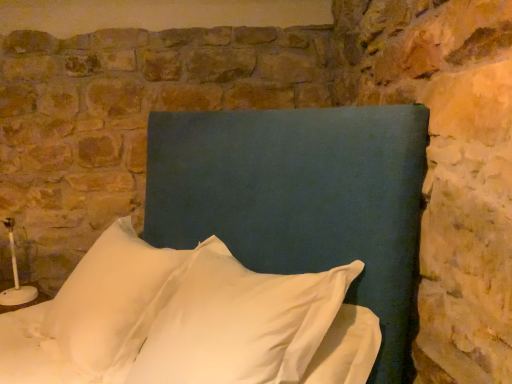
Question: Would you consider matte blue headboard at center to be distant from white fabric pillow at center, which is the first pillow in right-to-left order?

Choices:
 (A) yes
 (B) no

Answer: (B)

Question: From the image's perspective, is matte blue headboard at center under white fabric pillow at center, the second pillow in the left-to-right sequence?

Choices:
 (A) no
 (B) yes

Answer: (A)

Question: Is matte blue headboard at center shorter than white fabric pillow at center, the second pillow in the left-to-right sequence?

Choices:
 (A) no
 (B) yes

Answer: (A)

Question: Is matte blue headboard at center completely or partially outside of white fabric pillow at center, the second pillow in the left-to-right sequence?

Choices:
 (A) no
 (B) yes

Answer: (A)

Question: Is white fabric pillow at center, the second pillow in the left-to-right sequence, at the back of matte blue headboard at center?

Choices:
 (A) yes
 (B) no

Answer: (A)

Question: Is matte blue headboard at center oriented towards white fabric pillow at center, which is the first pillow in right-to-left order?

Choices:
 (A) yes
 (B) no

Answer: (A)

Question: Does matte blue headboard at center have a lesser height compared to white soft pillow at center, acting as the 1th pillow starting from the left?

Choices:
 (A) no
 (B) yes

Answer: (A)

Question: Can you confirm if matte blue headboard at center is positioned to the left of white soft pillow at center, acting as the 1th pillow starting from the left?

Choices:
 (A) no
 (B) yes

Answer: (A)

Question: Is the position of matte blue headboard at center more distant than that of white soft pillow at center, acting as the 1th pillow starting from the left?

Choices:
 (A) yes
 (B) no

Answer: (B)

Question: From a real-world perspective, is matte blue headboard at center physically below white soft pillow at center, positioned as the 2th pillow in right-to-left order?

Choices:
 (A) no
 (B) yes

Answer: (A)

Question: From the image's perspective, is matte blue headboard at center on top of white soft pillow at center, acting as the 1th pillow starting from the left?

Choices:
 (A) no
 (B) yes

Answer: (B)

Question: From a real-world perspective, is matte blue headboard at center on white soft pillow at center, positioned as the 2th pillow in right-to-left order?

Choices:
 (A) yes
 (B) no

Answer: (A)

Question: Is white soft pillow at center, acting as the 1th pillow starting from the left, thinner than white fabric pillow at center, which is the first pillow in right-to-left order?

Choices:
 (A) no
 (B) yes

Answer: (A)